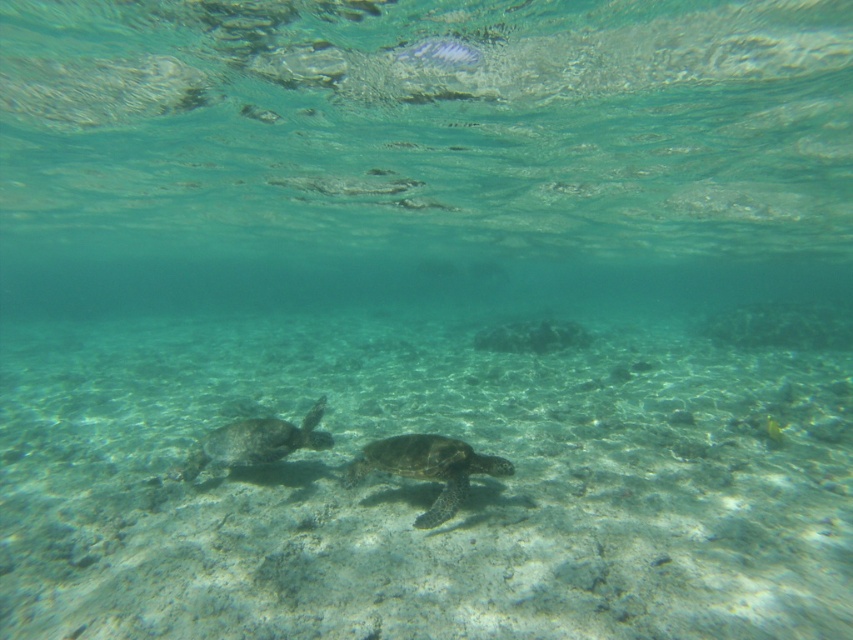
Is green textured shell at center wider than green matte turtle at lower left?

No.

Is green textured shell at center shorter than green matte turtle at lower left?

Yes.

At what (x,y) coordinates should I click in order to perform the action: click on green textured shell at center. Please return your answer as a coordinate pair (x, y). Looking at the image, I should click on (427, 467).